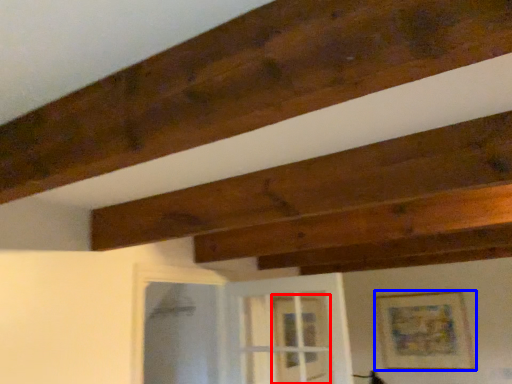
Question: Which point is closer to the camera, glass door (highlighted by a red box) or picture frame (highlighted by a blue box)?

Choices:
 (A) glass door
 (B) picture frame

Answer: (A)